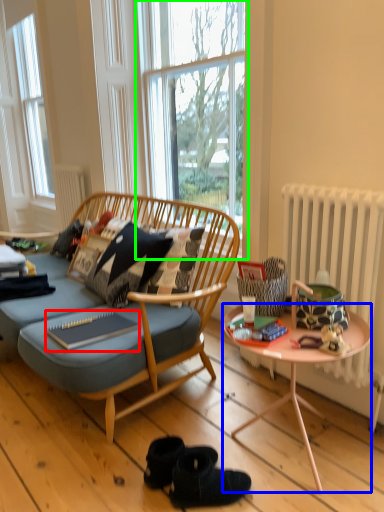
Question: Which object is positioned closest to magazine (highlighted by a red box)? Select from desk (highlighted by a blue box) and window (highlighted by a green box).

Choices:
 (A) desk
 (B) window

Answer: (A)